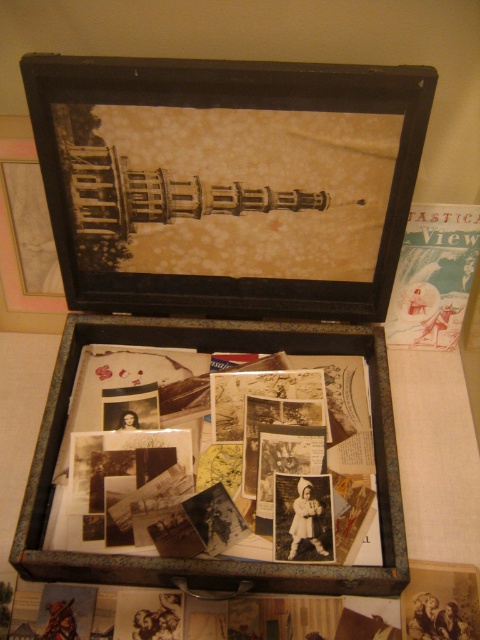
Question: Can you confirm if metallic suitcase at center is positioned below gold metallic tower at upper center?

Choices:
 (A) no
 (B) yes

Answer: (B)

Question: Based on their relative distances, which object is nearer to the metallic suitcase at center?

Choices:
 (A) gold metallic tower at upper center
 (B) blue paper postcard at upper right

Answer: (B)

Question: In this image, where is gold metallic tower at upper center located relative to blue paper postcard at upper right?

Choices:
 (A) below
 (B) above

Answer: (B)

Question: Which point is farther to the camera?

Choices:
 (A) blue paper postcard at upper right
 (B) metallic suitcase at center
 (C) gold metallic tower at upper center

Answer: (A)

Question: Does metallic suitcase at center have a lesser width compared to blue paper postcard at upper right?

Choices:
 (A) yes
 (B) no

Answer: (B)

Question: Which point appears farthest from the camera in this image?

Choices:
 (A) (113, 332)
 (B) (224, 209)

Answer: (A)